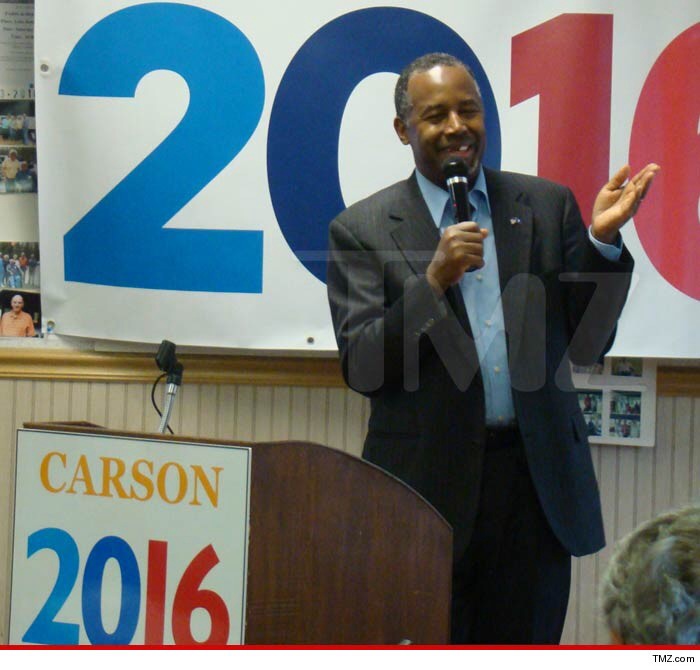
You are a GUI agent. You are given a task and a screenshot of the screen. Output one action in this format:
    pyautogui.click(x=<x>, y=<y>)
    Task: Click on the podium
    
    Given the screenshot: What is the action you would take?
    341,557